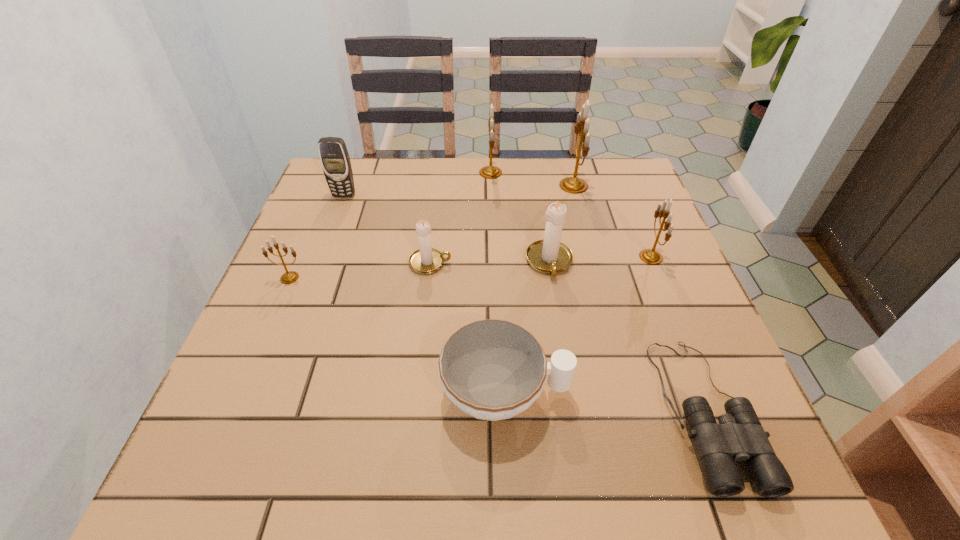
Locate which candle holder is the fifth closest to the cellular telephone. Please provide its 2D coordinates. Your answer should be formatted as a tuple, i.e. [(x, y)], where the tuple contains the x and y coordinates of a point satisfying the conditions above.

[(575, 185)]

Point out which gold candelabrum is positioned as the third nearest to the rightmost candle holder. Please provide its 2D coordinates. Your answer should be formatted as a tuple, i.e. [(x, y)], where the tuple contains the x and y coordinates of a point satisfying the conditions above.

[(289, 277)]

Locate an element on the screen. gold candelabrum that can be found as the third closest to the leftmost candle holder is located at coordinates (651, 256).

Image resolution: width=960 pixels, height=540 pixels. Identify the location of vacant area in the image that satisfies the following two spatial constraints: 1. on the front side of the third gold candelabrum from left to right; 2. on the side with the handle of the eighth tallest object. (629, 392).

The image size is (960, 540). In order to click on vacant space that satisfies the following two spatial constraints: 1. on the front side of the eighth shortest object; 2. on the right side of the second candle holder from right to left in this screenshot , I will do `click(492, 186)`.